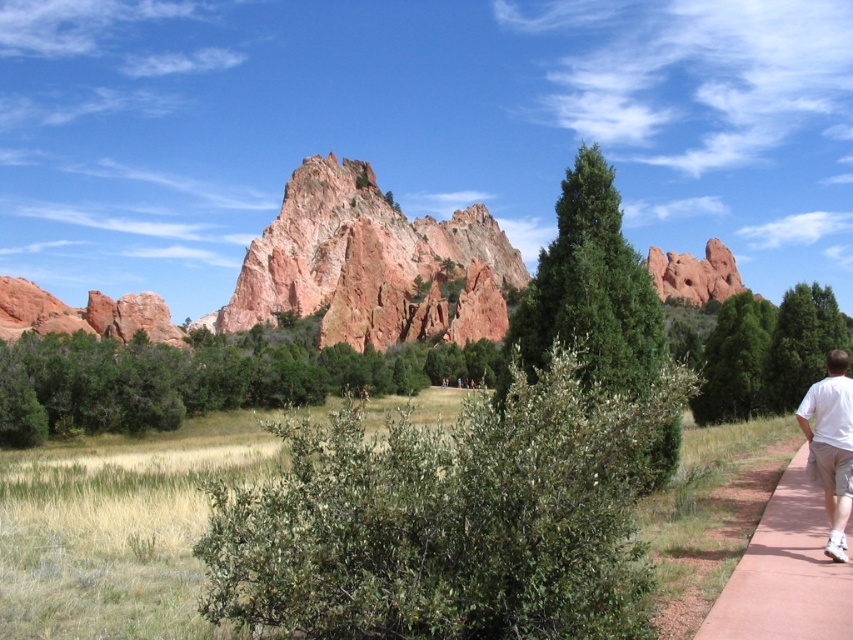
Question: Which point is farther from the camera taking this photo?

Choices:
 (A) (329, 573)
 (B) (335, 163)
 (C) (750, 564)
 (D) (59, 344)

Answer: (B)

Question: Can you confirm if green textured pine at center is positioned below white cotton shirt at right?

Choices:
 (A) yes
 (B) no

Answer: (B)

Question: Estimate the real-world distances between objects in this image. Which object is farther from the green leafy tree at center?

Choices:
 (A) green textured tree at center
 (B) red concrete sidewalk at lower right

Answer: (B)

Question: Does green leafy bush at center have a larger size compared to rustic sandstone rock formation at center?

Choices:
 (A) yes
 (B) no

Answer: (B)

Question: Does green leafy bush at center have a smaller size compared to white cotton shirt at right?

Choices:
 (A) no
 (B) yes

Answer: (A)

Question: Which of the following is the farthest from the observer?

Choices:
 (A) green leafy bush at center
 (B) green textured pine at center

Answer: (B)